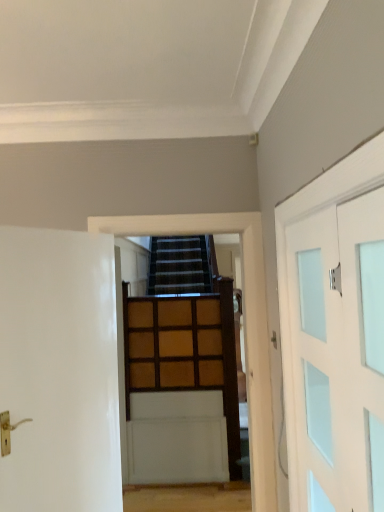
Question: From a real-world perspective, does wooden paneling at center stand above wooden paneling at center?

Choices:
 (A) yes
 (B) no

Answer: (A)

Question: Is wooden paneling at center taller than wooden paneling at center?

Choices:
 (A) no
 (B) yes

Answer: (B)

Question: Is wooden paneling at center directly adjacent to wooden paneling at center?

Choices:
 (A) yes
 (B) no

Answer: (B)

Question: Is wooden paneling at center not inside wooden paneling at center?

Choices:
 (A) yes
 (B) no

Answer: (A)

Question: Considering the relative sizes of wooden paneling at center and wooden paneling at center in the image provided, is wooden paneling at center smaller than wooden paneling at center?

Choices:
 (A) no
 (B) yes

Answer: (A)

Question: In terms of size, does wooden paneling at center appear bigger or smaller than white frosted glass door at right, the 1th door when ordered from right to left?

Choices:
 (A) big
 (B) small

Answer: (A)

Question: Is point (253, 330) positioned closer to the camera than point (375, 264)?

Choices:
 (A) closer
 (B) farther

Answer: (B)

Question: From their relative heights in the image, would you say wooden paneling at center is taller or shorter than white frosted glass door at right, the 2th door in the left-to-right sequence?

Choices:
 (A) tall
 (B) short

Answer: (A)

Question: Would you say wooden paneling at center is inside or outside white frosted glass door at right, the 2th door in the left-to-right sequence?

Choices:
 (A) inside
 (B) outside

Answer: (B)

Question: In terms of size, does white frosted glass door at right, the 2th door in the left-to-right sequence, appear bigger or smaller than wooden paneling at center?

Choices:
 (A) big
 (B) small

Answer: (B)

Question: Which is correct: white frosted glass door at right, the 2th door in the left-to-right sequence, is inside wooden paneling at center, or outside of it?

Choices:
 (A) outside
 (B) inside

Answer: (A)

Question: Would you say white frosted glass door at right, the 2th door in the left-to-right sequence, is to the left or to the right of wooden paneling at center in the picture?

Choices:
 (A) right
 (B) left

Answer: (A)

Question: In the image, is white frosted glass door at right, the 1th door when ordered from right to left, positioned in front of or behind wooden paneling at center?

Choices:
 (A) behind
 (B) front

Answer: (B)

Question: From the image's perspective, relative to white glossy door at left, the second door when ordered from right to left, is wooden paneling at center above or below?

Choices:
 (A) below
 (B) above

Answer: (B)

Question: In terms of width, does wooden paneling at center look wider or thinner when compared to white glossy door at left, the second door when ordered from right to left?

Choices:
 (A) thin
 (B) wide

Answer: (B)